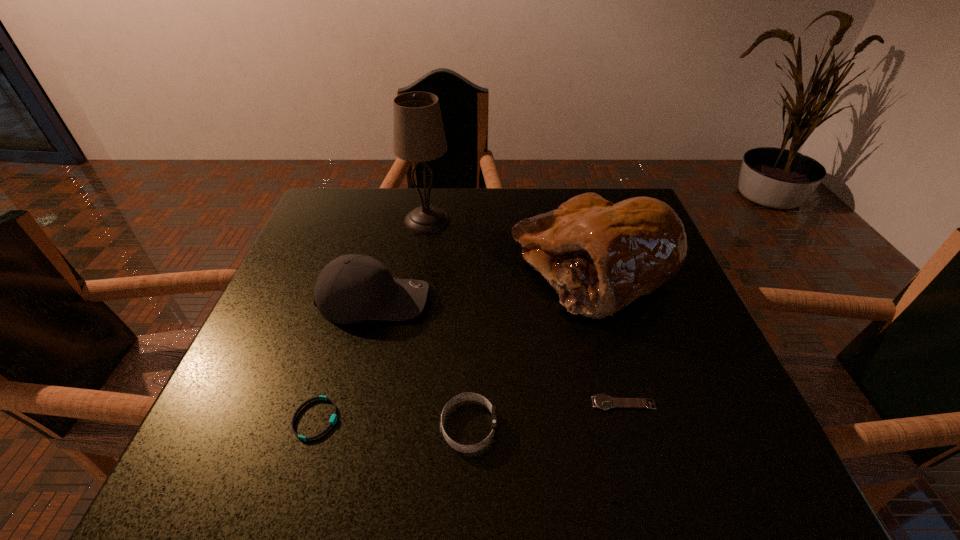
Where is `unoccupied area between the fourth object from left to right and the tallest object`? This screenshot has width=960, height=540. unoccupied area between the fourth object from left to right and the tallest object is located at coordinates (448, 323).

Identify the location of free spot between the fourth tallest object and the tallest object. (448, 323).

Where is `free space between the shortest object and the third object from right to left`? The width and height of the screenshot is (960, 540). free space between the shortest object and the third object from right to left is located at coordinates (546, 415).

Identify the location of unoccupied position between the fourth shortest object and the bread. The image size is (960, 540). (483, 284).

At what (x,y) coordinates should I click in order to perform the action: click on empty location between the right wristband and the fifth shortest object. Please return your answer as a coordinate pair (x, y). The width and height of the screenshot is (960, 540). Looking at the image, I should click on (531, 348).

Find the location of a particular element. The width and height of the screenshot is (960, 540). free space between the bread and the lampshade is located at coordinates (510, 245).

I want to click on vacant space that is in between the left wristband and the bread, so click(x=454, y=344).

Locate an element on the screen. Image resolution: width=960 pixels, height=540 pixels. the third closest object relative to the baseball cap is located at coordinates (600, 257).

Where is `object that is the third closest to the shorter wristband`? The image size is (960, 540). object that is the third closest to the shorter wristband is located at coordinates (600, 257).

Locate an element on the screen. vacant space that satisfies the following two spatial constraints: 1. on the front brim of the baseball cap; 2. on the left side of the watch is located at coordinates (348, 403).